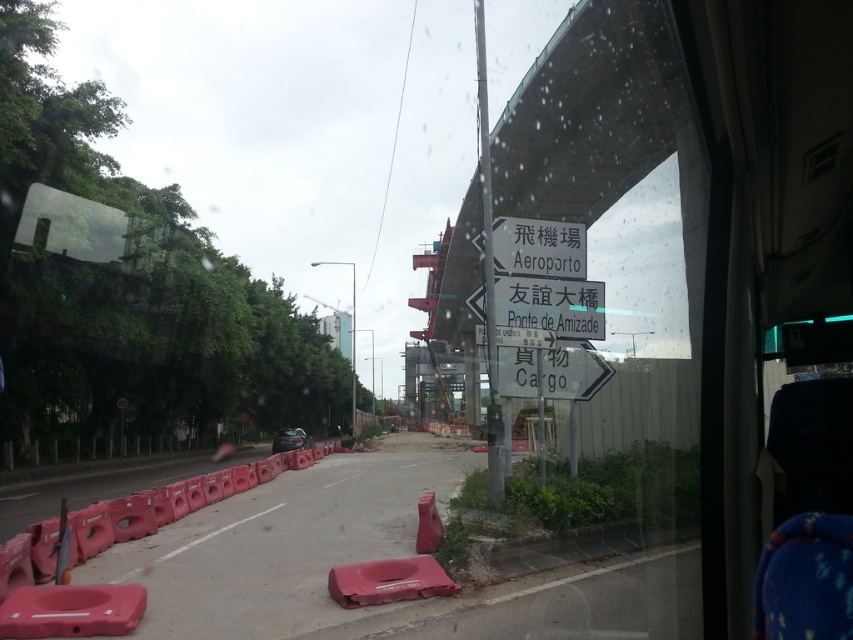
Question: Can you confirm if rubberized plastic barriers at lower left is positioned to the left of white plastic sign at center?

Choices:
 (A) yes
 (B) no

Answer: (A)

Question: Does rubberized plastic barriers at lower left have a smaller size compared to white paper sign at center?

Choices:
 (A) yes
 (B) no

Answer: (B)

Question: Among these objects, which one is nearest to the camera?

Choices:
 (A) white paper sign at center
 (B) rubberized plastic barriers at lower left

Answer: (B)

Question: Estimate the real-world distances between objects in this image. Which object is closer to the white paper sign at center?

Choices:
 (A) rubberized plastic barriers at lower left
 (B) white plastic sign at center

Answer: (B)

Question: Which object appears farthest from the camera in this image?

Choices:
 (A) white plastic sign at center
 (B) rubberized plastic barriers at lower left

Answer: (A)

Question: Does white plastic sign at center appear on the right side of white paper sign at center?

Choices:
 (A) yes
 (B) no

Answer: (A)